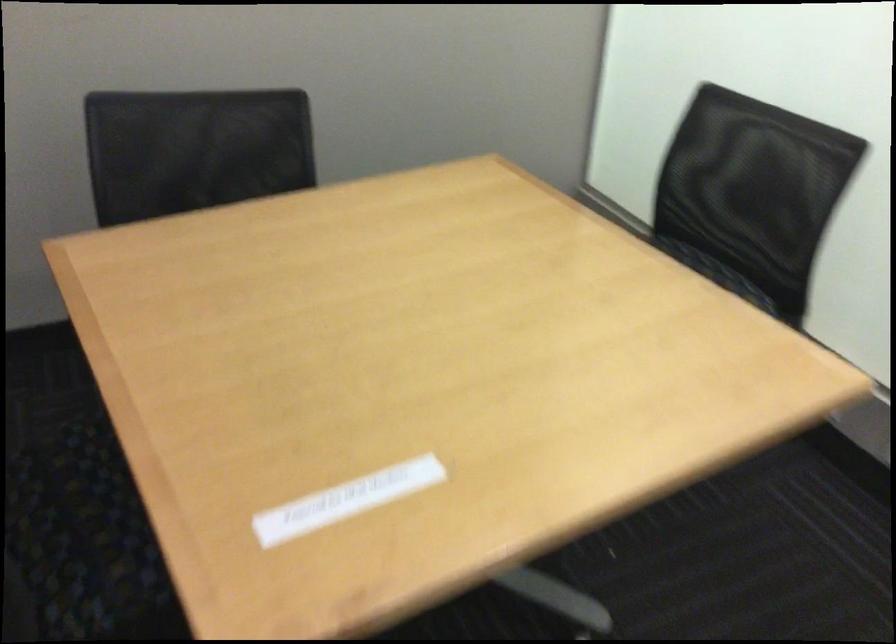
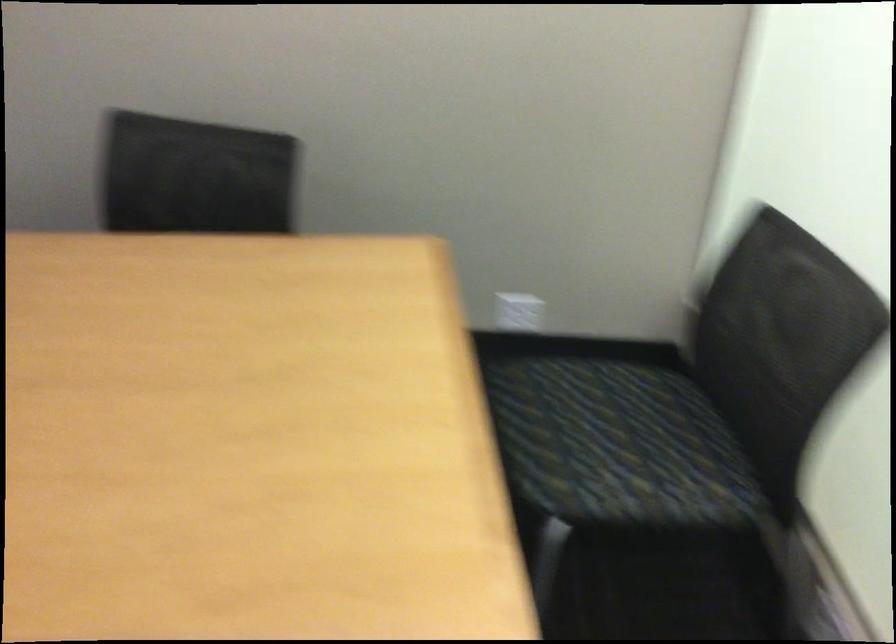
Question: Based on the continuous images, in which direction is the camera rotating? Reply with the corresponding letter.

Choices:
 (A) Left
 (B) Right
 (C) Up
 (D) Down

Answer: (A)